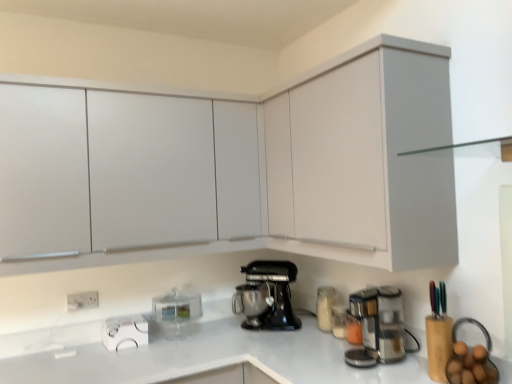
Question: From the image's perspective, is matte white cabinet at upper center, which is the 3th cabinetry from back to front, over white plastic electric outlet at lower left?

Choices:
 (A) no
 (B) yes

Answer: (B)

Question: Can you see matte white cabinet at upper center, which is the 3th cabinetry from back to front, touching white plastic electric outlet at lower left?

Choices:
 (A) no
 (B) yes

Answer: (A)

Question: Considering the relative sizes of matte white cabinet at upper center, which is the 3th cabinetry from back to front, and white plastic electric outlet at lower left in the image provided, is matte white cabinet at upper center, which is the 3th cabinetry from back to front, smaller than white plastic electric outlet at lower left?

Choices:
 (A) yes
 (B) no

Answer: (B)

Question: Is matte white cabinet at upper center, which appears as the 1th cabinetry when viewed from the front, aimed at white plastic electric outlet at lower left?

Choices:
 (A) no
 (B) yes

Answer: (A)

Question: Does matte white cabinet at upper center, which is the 3th cabinetry from back to front, appear on the right side of white plastic electric outlet at lower left?

Choices:
 (A) no
 (B) yes

Answer: (B)

Question: From the image's perspective, is black matte stand mixer at center, the first kitchen appliance viewed from the right, located above or below white glossy kettle at lower left?

Choices:
 (A) above
 (B) below

Answer: (A)

Question: Considering the positions of point (271, 302) and point (116, 329), is point (271, 302) closer or farther from the camera than point (116, 329)?

Choices:
 (A) farther
 (B) closer

Answer: (A)

Question: Considering the relative positions of black matte stand mixer at center, the first kitchen appliance viewed from the right, and white glossy kettle at lower left in the image provided, is black matte stand mixer at center, the first kitchen appliance viewed from the right, to the left or to the right of white glossy kettle at lower left?

Choices:
 (A) right
 (B) left

Answer: (A)

Question: Relative to white glossy kettle at lower left, is black matte stand mixer at center, the first kitchen appliance viewed from the right, in front or behind?

Choices:
 (A) behind
 (B) front

Answer: (A)

Question: Is white glossy kettle at lower left wider or thinner than transparent plastic container at center, positioned as the 2th kitchen appliance in right-to-left order?

Choices:
 (A) wide
 (B) thin

Answer: (B)

Question: Considering their positions, is white glossy kettle at lower left located in front of or behind transparent plastic container at center, positioned as the 2th kitchen appliance in right-to-left order?

Choices:
 (A) behind
 (B) front

Answer: (B)

Question: Is white glossy kettle at lower left bigger or smaller than transparent plastic container at center, which is the first kitchen appliance from left to right?

Choices:
 (A) big
 (B) small

Answer: (B)

Question: From the image's perspective, is white glossy kettle at lower left located above or below transparent plastic container at center, positioned as the 2th kitchen appliance in right-to-left order?

Choices:
 (A) above
 (B) below

Answer: (B)

Question: Considering their positions, is stainless steel coffee maker at lower right located in front of or behind white plastic electric outlet at lower left?

Choices:
 (A) front
 (B) behind

Answer: (A)

Question: Visually, is stainless steel coffee maker at lower right positioned to the left or to the right of white plastic electric outlet at lower left?

Choices:
 (A) left
 (B) right

Answer: (B)